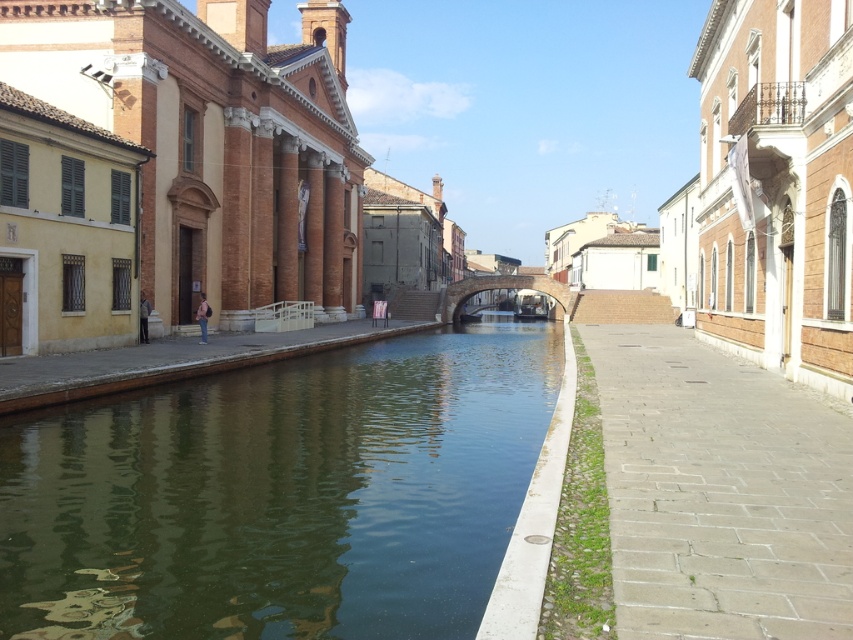
You are a tourist standing on the green concrete sidewalk at lower right, looking down at the greenish water at center. Which object is lower in position?

The greenish water at center is below the green concrete sidewalk at lower right, so the greenish water at center is lower in position.

What are the coordinates of the greenish water at center in the image?

The greenish water at center is located at point (x=281, y=493).